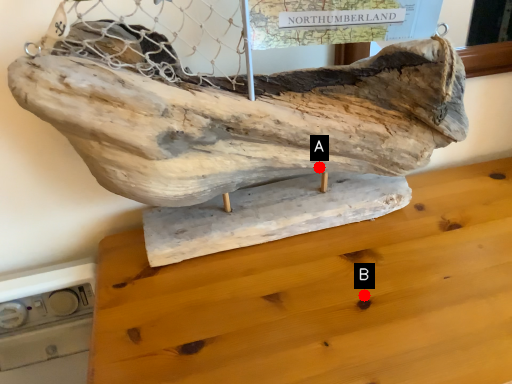
Question: Two points are circled on the image, labeled by A and B beside each circle. Which of the following is the farthest from the observer?

Choices:
 (A) A is further
 (B) B is further

Answer: (A)